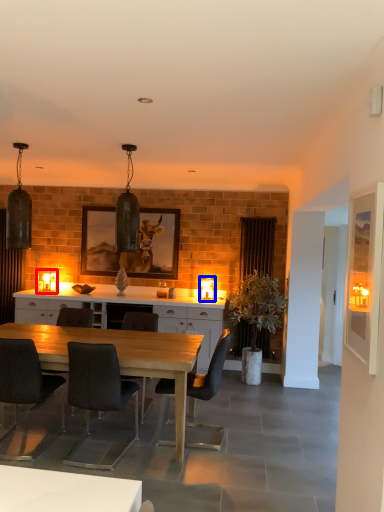
Question: Which of the following is the closest to the observer, lamp (highlighted by a red box) or lamp (highlighted by a blue box)?

Choices:
 (A) lamp
 (B) lamp

Answer: (B)